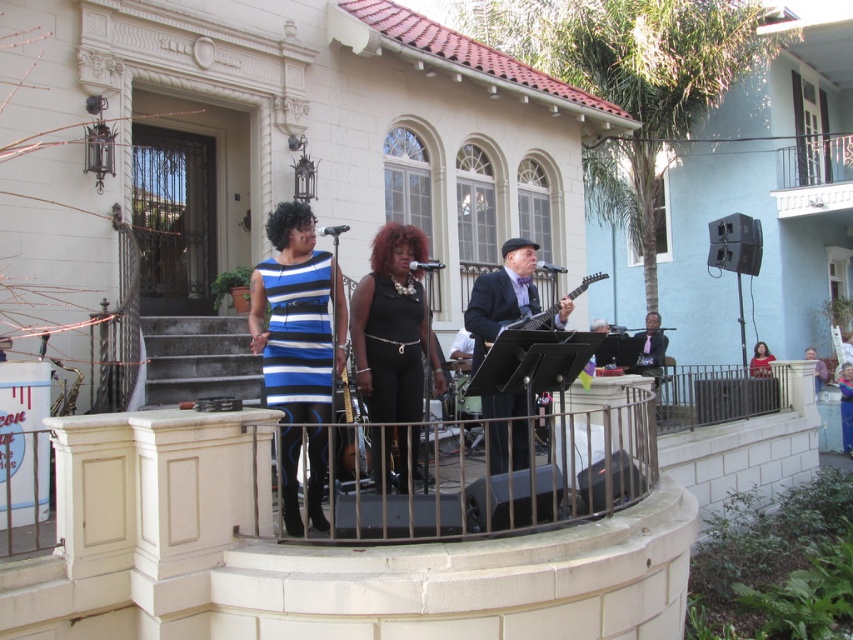
You are a photographer trying to capture a group photo of the performers on the balcony. You notice two performers wearing black satin dress at center and shiny black suit at center. Which performer should you position closer to the edge of the balcony to ensure both fit in the frame without overlapping?

The black satin dress at center has a lesser width compared to the shiny black suit at center, so you should position the performer in the black satin dress at center closer to the edge to accommodate the wider performer in the shiny black suit at center within the frame.

You are a photographer on the ground looking up at the balcony. You want to take a photo that includes both the shiny black suit at center and the shiny black guitar at center. Which one should you position closer to the left side of your camera frame?

The shiny black guitar at center should be positioned closer to the left side of your camera frame because the shiny black suit at center is to the right of the shiny black guitar at center.

You are a photographer trying to capture a clear shot of both the blue striped dress at center and the shiny black guitar at center. Which object should you focus on first if you want to ensure both are in focus, considering their sizes?

The blue striped dress at center is wider than the shiny black guitar at center, so focusing on the wider object first would help maintain focus on both.